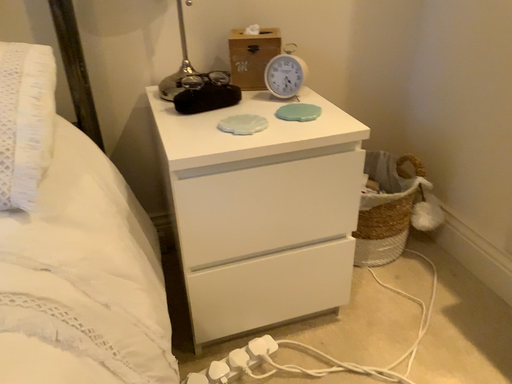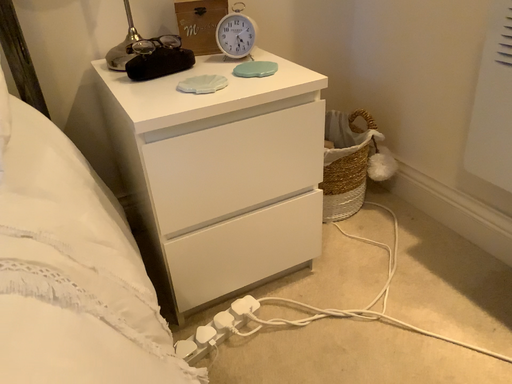
Question: How did the camera likely rotate when shooting the video?

Choices:
 (A) rotated right
 (B) rotated left

Answer: (A)